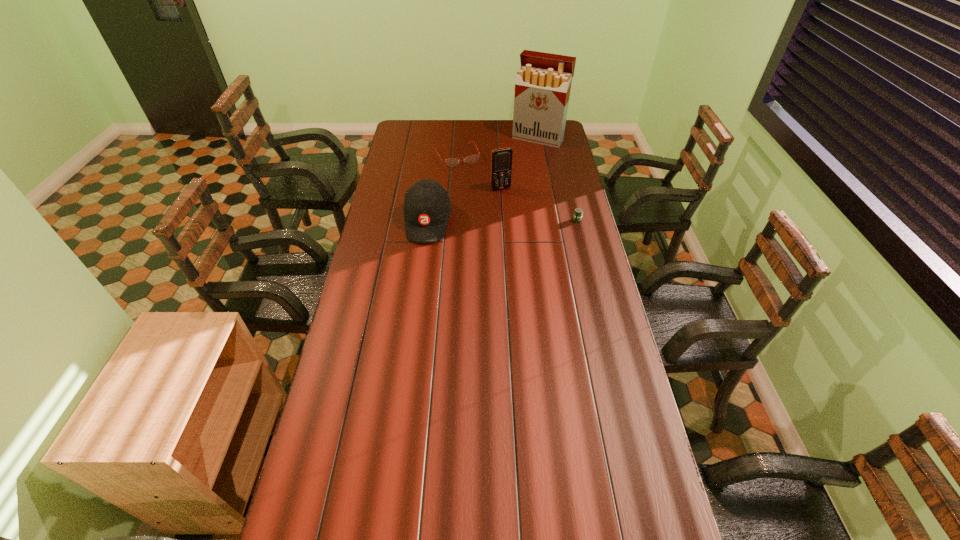
You are a GUI agent. You are given a task and a screenshot of the screen. Output one action in this format:
    pyautogui.click(x=<x>, y=<y>)
    Task: Click on the baseball cap
    
    Given the screenshot: What is the action you would take?
    pyautogui.click(x=427, y=207)

You are a GUI agent. You are given a task and a screenshot of the screen. Output one action in this format:
    pyautogui.click(x=<x>, y=<y>)
    Task: Click on the beer can
    
    Given the screenshot: What is the action you would take?
    pyautogui.click(x=578, y=212)

Identify the location of spectacles. (451, 162).

The height and width of the screenshot is (540, 960). Identify the location of the third object from right to left. (501, 159).

Where is `the third nearest object`? The height and width of the screenshot is (540, 960). the third nearest object is located at coordinates (501, 159).

The image size is (960, 540). What are the coordinates of `cigarette case` in the screenshot? It's located at (543, 83).

At what (x,y) coordinates should I click in order to perform the action: click on vacant space located 0.230m with a logo on the front of the baseball cap. Please return your answer as a coordinate pair (x, y). Looking at the image, I should click on (419, 287).

Where is `vacant space located on the front of the beer can`? The image size is (960, 540). vacant space located on the front of the beer can is located at coordinates (587, 259).

Locate an element on the screen. The width and height of the screenshot is (960, 540). free space located 0.240m on the lenses of the spectacles is located at coordinates (479, 195).

The height and width of the screenshot is (540, 960). Find the location of `free location located on the lenses of the spectacles`. free location located on the lenses of the spectacles is located at coordinates (477, 191).